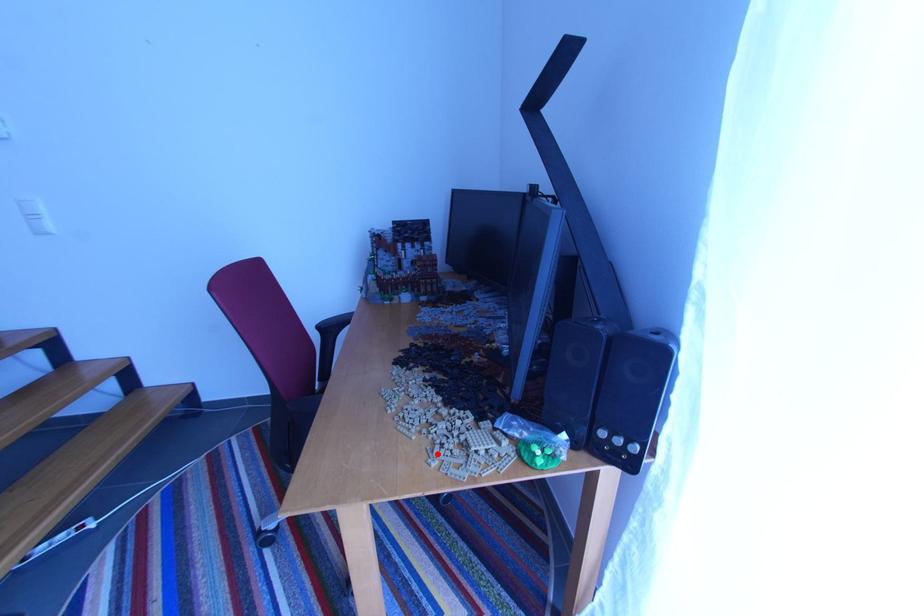
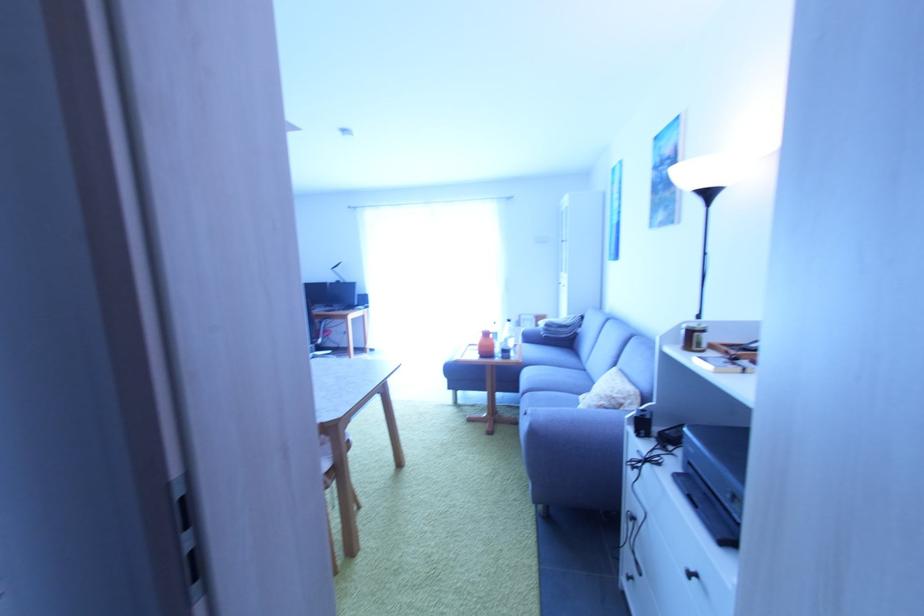
Question: I am providing you with two images of the same scene from different viewpoints. A red point is marked on the first image. Can you still see the location of the red point in image 2?

Choices:
 (A) Yes
 (B) No

Answer: (B)